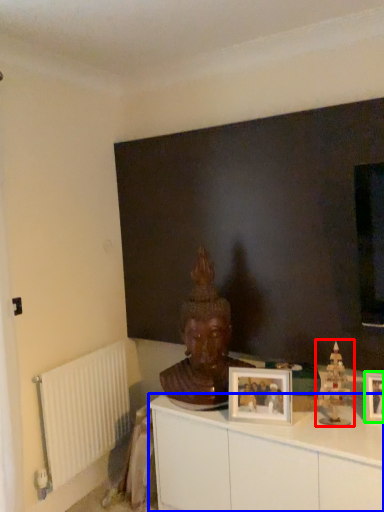
Question: Which object is positioned closest to toy (highlighted by a red box)? Select from cabinetry (highlighted by a blue box) and picture frame (highlighted by a green box).

Choices:
 (A) cabinetry
 (B) picture frame

Answer: (B)